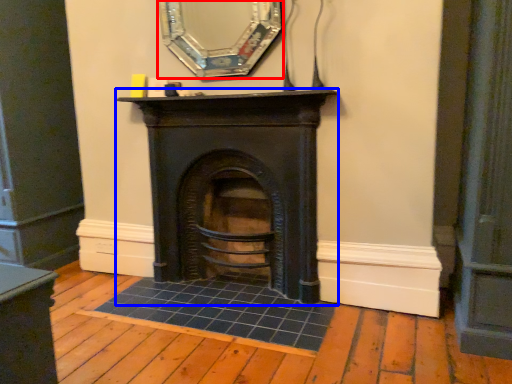
Question: Which of the following is the farthest to the observer, mirror (highlighted by a red box) or fireplace (highlighted by a blue box)?

Choices:
 (A) mirror
 (B) fireplace

Answer: (B)